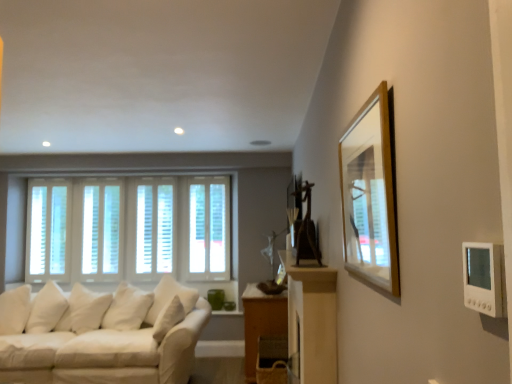
Question: Does point (220, 185) appear closer or farther from the camera than point (354, 170)?

Choices:
 (A) farther
 (B) closer

Answer: (A)

Question: From a real-world perspective, is white wood blinds at center, positioned as the first window in right-to-left order, above or below wooden frame at upper right?

Choices:
 (A) below
 (B) above

Answer: (A)

Question: Estimate the real-world distances between objects in this image. Which object is closer to the white wood blinds at center, positioned as the first window in right-to-left order?

Choices:
 (A) white wood blinds at center, placed as the third window when sorted from left to right
 (B) white wood blinds at left, positioned as the first window in left-to-right order
 (C) white fabric couch at lower left
 (D) white wood window at center, which ranks as the 2th window in left-to-right order
 (E) wooden frame at upper right

Answer: (A)

Question: Which of these objects is positioned closest to the white wood blinds at left, which appears as the 4th window when viewed from the right?

Choices:
 (A) white wood blinds at center, which is counted as the fourth window, starting from the left
 (B) wooden table at lower center
 (C) white fabric couch at lower left
 (D) white wood window at center, which ranks as the 2th window in left-to-right order
 (E) wooden frame at upper right

Answer: (D)